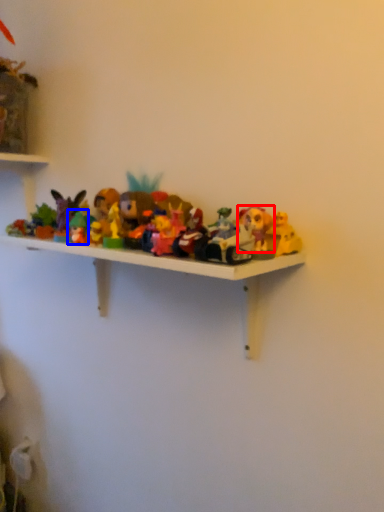
Question: Which point is further to the camera, toy (highlighted by a red box) or toy (highlighted by a blue box)?

Choices:
 (A) toy
 (B) toy

Answer: (B)